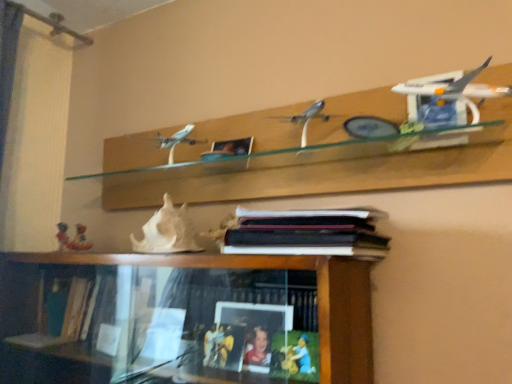
Question: Does white glossy airplane at upper right turn towards hardcover book at center?

Choices:
 (A) yes
 (B) no

Answer: (B)

Question: Does white glossy airplane at upper right lie in front of hardcover book at center?

Choices:
 (A) yes
 (B) no

Answer: (A)

Question: From the image's perspective, is white glossy airplane at upper right on hardcover book at center?

Choices:
 (A) no
 (B) yes

Answer: (B)

Question: From the image's perspective, is white glossy airplane at upper right below hardcover book at center?

Choices:
 (A) no
 (B) yes

Answer: (A)

Question: Is white glossy airplane at upper right smaller than hardcover book at center?

Choices:
 (A) no
 (B) yes

Answer: (B)

Question: Relative to white matte seashell at center, the 1th toy in the front-to-back sequence, is hardcover book at center in front or behind?

Choices:
 (A) behind
 (B) front

Answer: (B)

Question: Is hardcover book at center taller or shorter than white matte seashell at center, the 1th toy in the front-to-back sequence?

Choices:
 (A) short
 (B) tall

Answer: (A)

Question: From a real-world perspective, relative to white matte seashell at center, which ranks as the second toy in left-to-right order, is hardcover book at center vertically above or below?

Choices:
 (A) below
 (B) above

Answer: (A)

Question: Considering the positions of point (309, 236) and point (162, 240), is point (309, 236) closer or farther from the camera than point (162, 240)?

Choices:
 (A) farther
 (B) closer

Answer: (B)

Question: Is white matte seashell at center, the 1th toy in the front-to-back sequence, in front of or behind matte plastic toy at lower left, marked as the 2th toy in a right-to-left arrangement, in the image?

Choices:
 (A) behind
 (B) front

Answer: (B)

Question: Is point (163, 243) closer or farther from the camera than point (78, 231)?

Choices:
 (A) closer
 (B) farther

Answer: (A)

Question: From a real-world perspective, is white matte seashell at center, acting as the second toy starting from the back, positioned above or below matte plastic toy at lower left, which is the first toy in back-to-front order?

Choices:
 (A) below
 (B) above

Answer: (B)

Question: Is white matte seashell at center, the 1th toy positioned from the right, inside or outside of matte plastic toy at lower left, the 1th toy from the left?

Choices:
 (A) outside
 (B) inside

Answer: (A)

Question: Is point (179, 246) positioned closer to the camera than point (384, 238)?

Choices:
 (A) closer
 (B) farther

Answer: (B)

Question: From the image's perspective, relative to hardcover book at center, is white matte seashell at center, the 1th toy positioned from the right, above or below?

Choices:
 (A) below
 (B) above

Answer: (B)